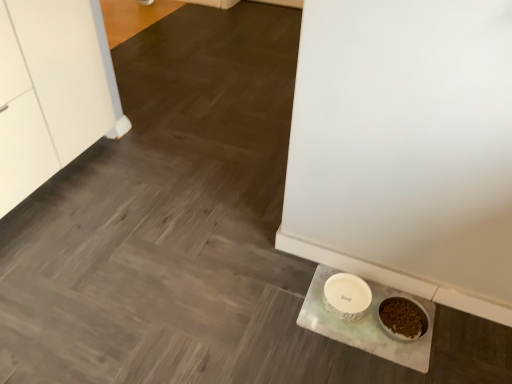
Question: Choose the correct answer: Is white speckled ceramic bowl at lower right inside white marble slate at lower right or outside it?

Choices:
 (A) inside
 (B) outside

Answer: (B)

Question: Considering the positions of point (337, 302) and point (420, 364), is point (337, 302) closer or farther from the camera than point (420, 364)?

Choices:
 (A) closer
 (B) farther

Answer: (B)

Question: From the image's perspective, is white speckled ceramic bowl at lower right above or below white marble slate at lower right?

Choices:
 (A) above
 (B) below

Answer: (A)

Question: Considering the positions of point (347, 334) and point (368, 288), is point (347, 334) closer or farther from the camera than point (368, 288)?

Choices:
 (A) closer
 (B) farther

Answer: (A)

Question: In terms of height, does white marble slate at lower right look taller or shorter compared to white speckled ceramic bowl at lower right?

Choices:
 (A) short
 (B) tall

Answer: (A)

Question: Is white marble slate at lower right inside the boundaries of white speckled ceramic bowl at lower right, or outside?

Choices:
 (A) inside
 (B) outside

Answer: (B)

Question: Would you say white marble slate at lower right is to the left or to the right of white speckled ceramic bowl at lower right in the picture?

Choices:
 (A) left
 (B) right

Answer: (B)